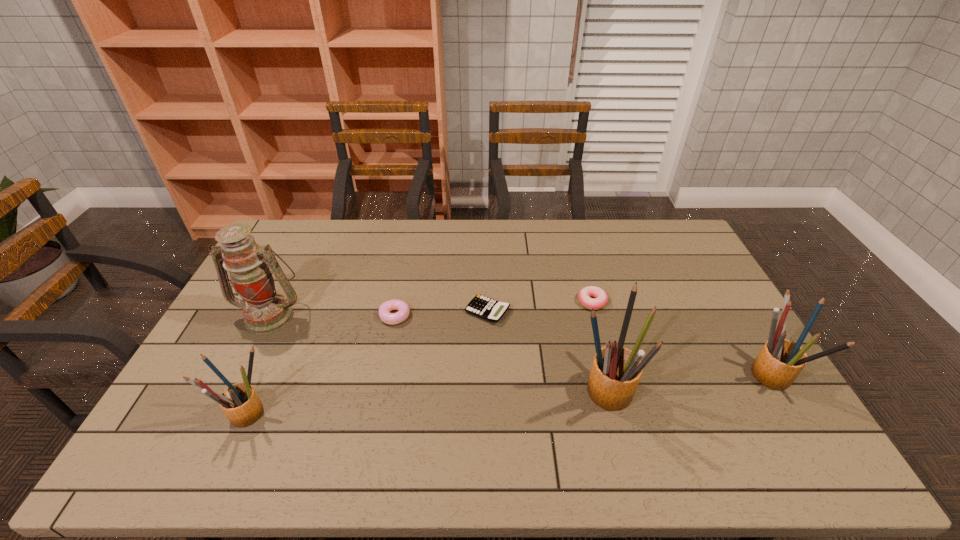
You are a GUI agent. You are given a task and a screenshot of the screen. Output one action in this format:
    pyautogui.click(x=<x>, y=<y>)
    Task: Click on the object that is at the near left corner
    This screenshot has height=540, width=960.
    Given the screenshot: What is the action you would take?
    pyautogui.click(x=240, y=403)

I want to click on object that is at the near right corner, so click(780, 361).

In the image, there is a desktop. What are the coordinates of `vacant region at the far edge` in the screenshot? It's located at (329, 222).

At what (x,y) coordinates should I click in order to perform the action: click on vacant space at the near edge of the desktop. Please return your answer as a coordinate pair (x, y). Looking at the image, I should click on (634, 406).

I want to click on free space at the left edge of the desktop, so click(x=301, y=258).

Image resolution: width=960 pixels, height=540 pixels. Find the location of `vacant space at the right edge of the desktop`. vacant space at the right edge of the desktop is located at coordinates (695, 276).

Locate an element on the screen. The height and width of the screenshot is (540, 960). vacant space at the near left corner is located at coordinates (209, 415).

Locate an element on the screen. free space between the oil lamp and the third object from left to right is located at coordinates (332, 315).

Where is `unoccupied area between the shortest object and the shortest pencil box`? The height and width of the screenshot is (540, 960). unoccupied area between the shortest object and the shortest pencil box is located at coordinates (367, 362).

Find the location of a particular element. The width and height of the screenshot is (960, 540). vacant space that's between the fifth shortest object and the fourth tallest object is located at coordinates (508, 394).